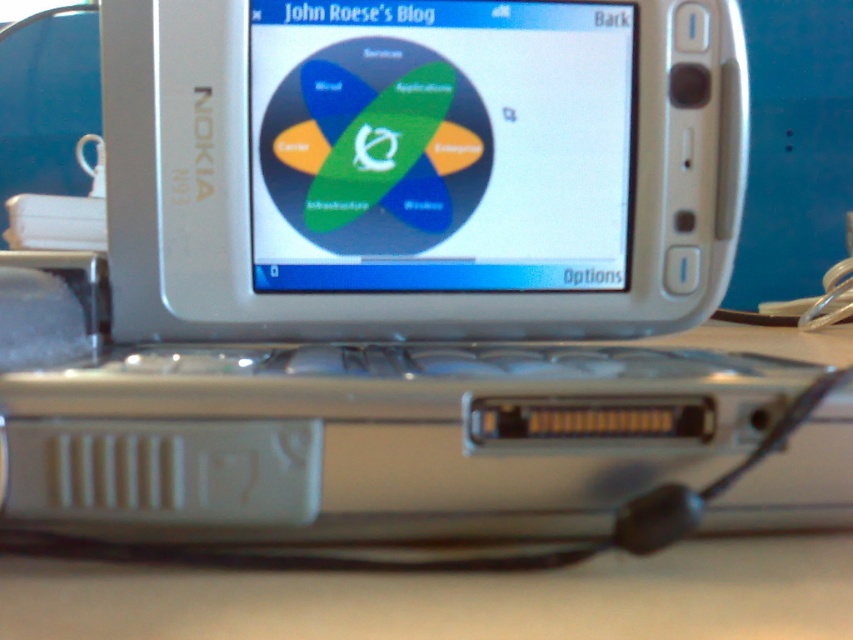
Based on the photo, between matte plastic screen at center and white plastic table at lower center, which one has more height?

matte plastic screen at center

Can you confirm if matte plastic screen at center is positioned above white plastic table at lower center?

Correct, matte plastic screen at center is located above white plastic table at lower center.

Between point (335, 77) and point (178, 568), which one is positioned behind?

The point (335, 77) is behind.

You are a GUI agent. You are given a task and a screenshot of the screen. Output one action in this format:
    pyautogui.click(x=<x>, y=<y>)
    Task: Click on the matte plastic screen at center
    The height and width of the screenshot is (640, 853).
    Given the screenshot: What is the action you would take?
    pyautogui.click(x=440, y=145)